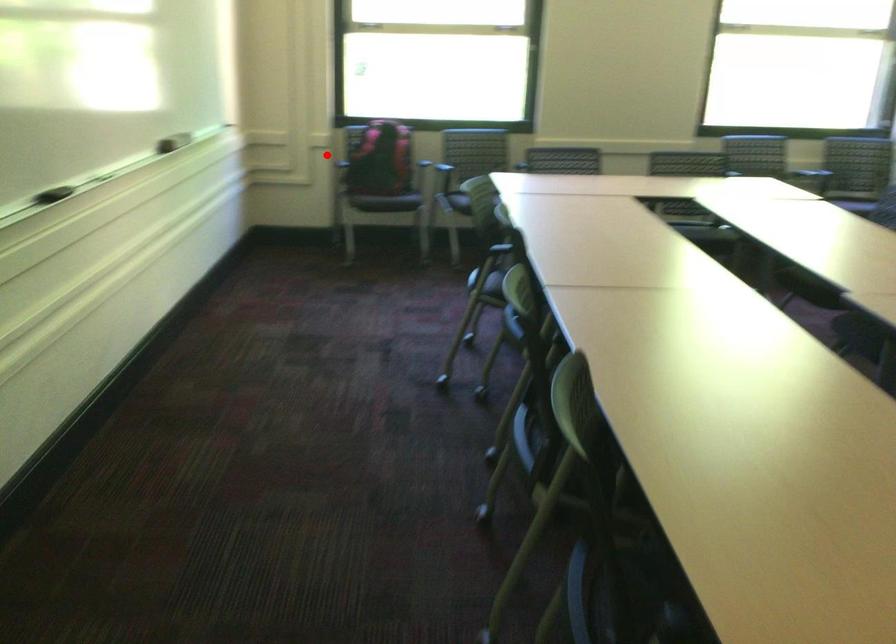
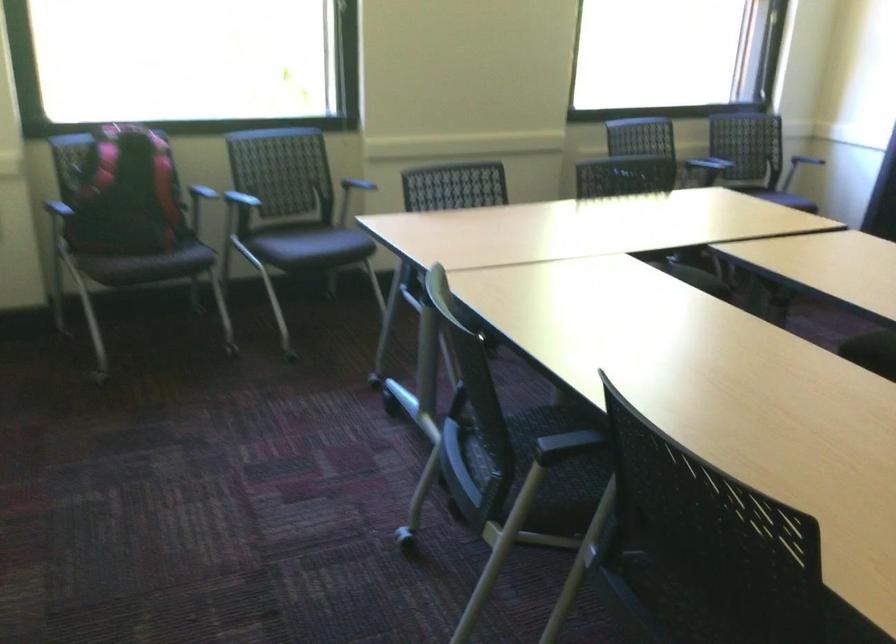
In the second image, find the point that corresponds to the highlighted location in the first image.

(42, 211)